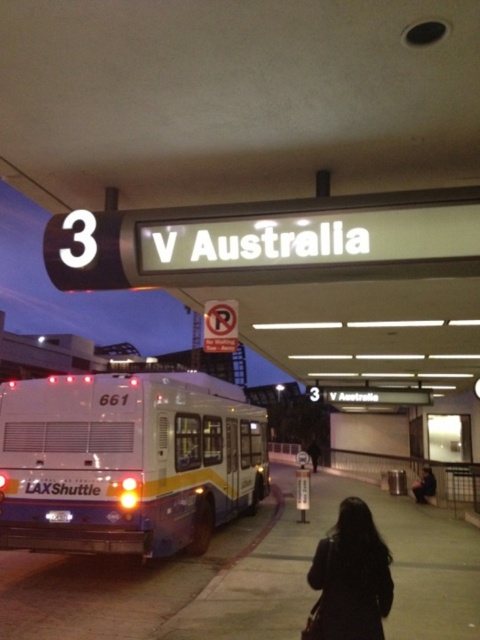
Does point (376, 564) come behind point (314, 460)?

No, it is not.

Does dark matte coat at center lie in front of black leather jacket at lower center?

Yes.

Who is more distant from viewer, (377, 616) or (316, 454)?

The point (316, 454) is more distant.

This screenshot has height=640, width=480. What are the coordinates of `dark matte coat at center` in the screenshot? It's located at (351, 577).

Which is above, dark matte coat at center or black fabric bag at lower center?

dark matte coat at center is higher up.

Between point (355, 538) and point (423, 486), which one is positioned behind?

Positioned behind is point (423, 486).

Does point (342, 528) come behind point (428, 493)?

No, (342, 528) is closer to viewer.

Identify the location of dark matte coat at center. This screenshot has height=640, width=480. (351, 577).

Can you confirm if white glossy bus at center is positioned below black fabric bag at lower center?

No, white glossy bus at center is not below black fabric bag at lower center.

Find the location of a particular element. white glossy bus at center is located at coordinates (127, 461).